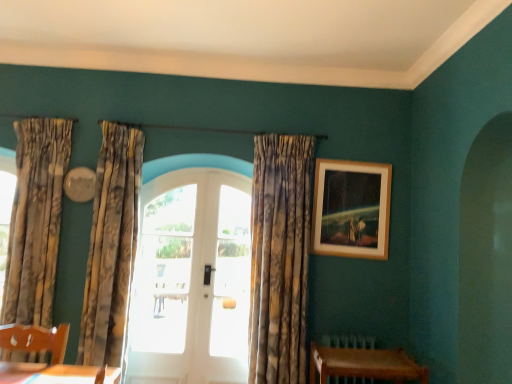
Question: In which direction should I rotate to look at white glass door at center, the second window viewed from the left?

Choices:
 (A) left
 (B) right

Answer: (A)

Question: Should I look upward or downward to see patterned fabric curtain at left, which ranks as the first curtain in left-to-right order?

Choices:
 (A) down
 (B) up

Answer: (A)

Question: Is the depth of white glass door at center, which is counted as the 2th window, starting from the right, greater than that of patterned fabric curtain at left, the third curtain in the right-to-left sequence?

Choices:
 (A) no
 (B) yes

Answer: (B)

Question: Considering the relative sizes of white glass door at center, the 1th window when ordered from left to right, and patterned fabric curtain at left, which ranks as the first curtain in left-to-right order, in the image provided, is white glass door at center, the 1th window when ordered from left to right, thinner than patterned fabric curtain at left, which ranks as the first curtain in left-to-right order,?

Choices:
 (A) no
 (B) yes

Answer: (B)

Question: Can you confirm if white glass door at center, which is counted as the 2th window, starting from the right, is positioned to the left of patterned fabric curtain at left, the third curtain in the right-to-left sequence?

Choices:
 (A) yes
 (B) no

Answer: (B)

Question: Is the position of white glass door at center, which is counted as the 2th window, starting from the right, less distant than that of patterned fabric curtain at left, which ranks as the first curtain in left-to-right order?

Choices:
 (A) yes
 (B) no

Answer: (B)

Question: Could you tell me if white glass door at center, the 1th window when ordered from left to right, is turned towards patterned fabric curtain at left, the third curtain in the right-to-left sequence?

Choices:
 (A) yes
 (B) no

Answer: (B)

Question: From a real-world perspective, is white glass door at center, which is counted as the 2th window, starting from the right, over patterned fabric curtain at left, which ranks as the first curtain in left-to-right order?

Choices:
 (A) yes
 (B) no

Answer: (B)

Question: Is white glass door at center, the second window viewed from the left, smaller than brown wooden radiator at lower right?

Choices:
 (A) no
 (B) yes

Answer: (A)

Question: Does white glass door at center, which is the first window from right to left, have a lesser height compared to brown wooden radiator at lower right?

Choices:
 (A) no
 (B) yes

Answer: (A)

Question: Is the position of white glass door at center, the second window viewed from the left, less distant than that of brown wooden radiator at lower right?

Choices:
 (A) no
 (B) yes

Answer: (A)

Question: Is white glass door at center, the second window viewed from the left, bigger than brown wooden radiator at lower right?

Choices:
 (A) yes
 (B) no

Answer: (A)

Question: Is white glass door at center, which is the first window from right to left, facing away from brown wooden radiator at lower right?

Choices:
 (A) yes
 (B) no

Answer: (B)

Question: Is white glass door at center, which is the first window from right to left, aimed at textured beige curtains at left, which ranks as the second curtain in left-to-right order?

Choices:
 (A) yes
 (B) no

Answer: (B)